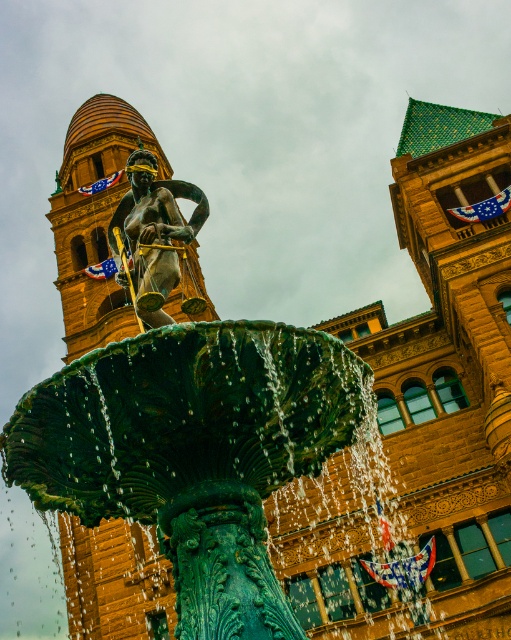
Question: Is golden stone bell tower at upper left thinner than bronze statue at center?

Choices:
 (A) no
 (B) yes

Answer: (A)

Question: Can you confirm if golden stone bell tower at upper left is positioned to the right of bronze statue at center?

Choices:
 (A) no
 (B) yes

Answer: (A)

Question: Does golden stone bell tower at upper left have a lesser width compared to bronze statue at center?

Choices:
 (A) no
 (B) yes

Answer: (A)

Question: Which object is farther from the camera taking this photo?

Choices:
 (A) golden stone bell tower at upper left
 (B) bronze statue at center

Answer: (A)

Question: Among these objects, which one is farthest from the camera?

Choices:
 (A) bronze statue at center
 (B) golden stone bell tower at upper left

Answer: (B)

Question: Which point is farther to the camera?

Choices:
 (A) golden stone bell tower at upper left
 (B) bronze statue at center

Answer: (A)